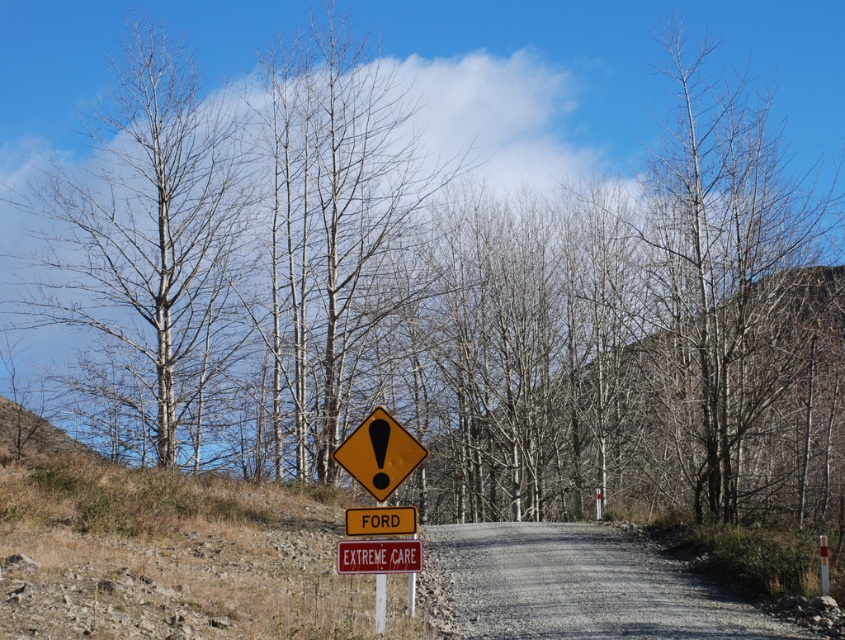
Question: Based on their relative distances, which object is farther from the white wood post at center?

Choices:
 (A) bare wood tree at left
 (B) yellow matte triangle at center

Answer: (A)

Question: Which point appears farthest from the camera in this image?

Choices:
 (A) (93, 250)
 (B) (647, 157)
 (C) (364, 532)

Answer: (B)

Question: Which point appears closest to the camera in this image?

Choices:
 (A) (560, 580)
 (B) (200, 115)
 (C) (369, 534)

Answer: (C)

Question: Can you confirm if bare wood tree at left is smaller than white wood post at center?

Choices:
 (A) yes
 (B) no

Answer: (A)

Question: Is gravel road at center thinner than yellow matte triangle at center?

Choices:
 (A) no
 (B) yes

Answer: (A)

Question: Is the position of yellow reflective plastic sign at center less distant than that of white wood post at center?

Choices:
 (A) yes
 (B) no

Answer: (B)